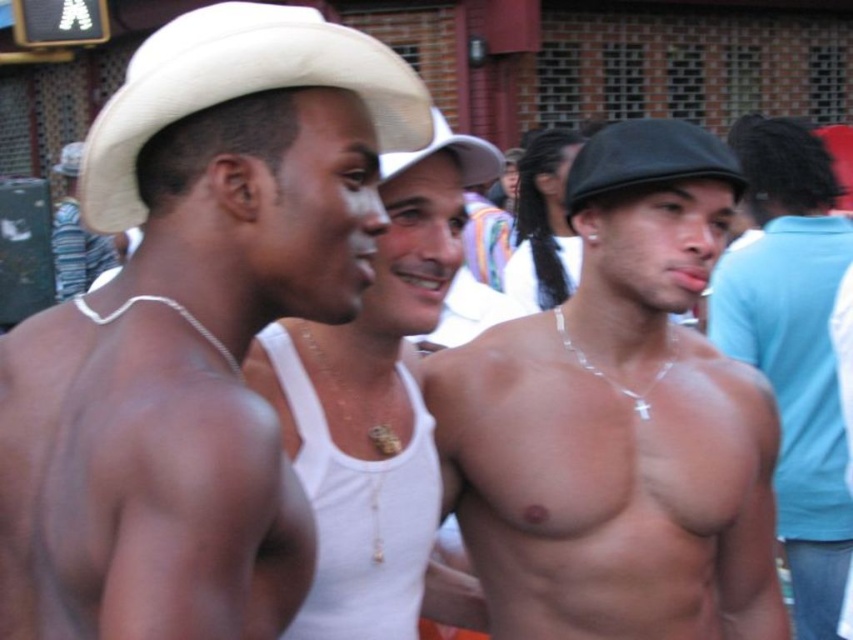
You are a photographer trying to capture a closeup of the shiny silver necklace at center and the white matte tank top at center. Which object should you focus on if you want to ensure both are in frame without moving the camera?

The shiny silver necklace at center might be wider than the white matte tank top at center, so you should focus on the wider object to ensure both fit in the frame.

You are a photographer trying to capture a closeup of the shiny silver necklace at center without including the white matte cowboy hat at upper left in the frame. Based on their positions, is this possible?

The white matte cowboy hat at upper left is above the shiny silver necklace at center, so if you position the camera below the necklace, you can avoid including the hat in the frame.